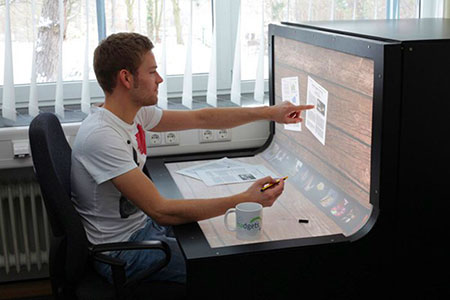
The width and height of the screenshot is (450, 300). Find the location of `desk`. desk is located at coordinates (290, 228).